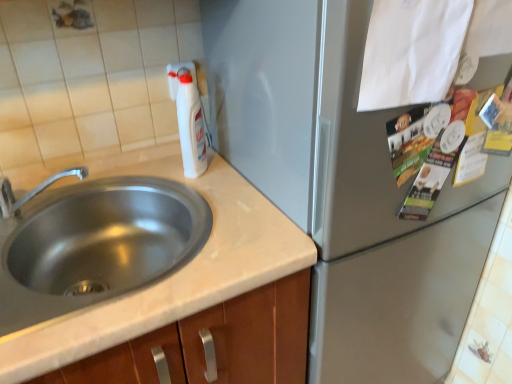
Describe the element at coordinates (31, 191) in the screenshot. The height and width of the screenshot is (384, 512). I see `brushed metal faucet at left` at that location.

Describe the element at coordinates (412, 51) in the screenshot. I see `white paper at upper right` at that location.

In order to face stainless steel sink at left, should I rotate leftwards or rightwards?

To align with it, rotate left about 20.034°.

Find the location of a particular element. The height and width of the screenshot is (384, 512). white plastic bottle at upper center is located at coordinates (189, 118).

At what (x,y) coordinates should I click in order to perform the action: click on brushed metal faucet at left. Please return your answer as a coordinate pair (x, y). Looking at the image, I should click on (31, 191).

From a real-world perspective, is satin silver refrigerator at center positioned above or below stainless steel sink at left?

From a real-world perspective, satin silver refrigerator at center is physically below stainless steel sink at left.

Based on the photo, between satin silver refrigerator at center and stainless steel sink at left, which one has more height?

satin silver refrigerator at center.

From the image's perspective, does satin silver refrigerator at center appear lower than stainless steel sink at left?

No.

Locate an element on the screen. The height and width of the screenshot is (384, 512). appliance in front of the stainless steel sink at left is located at coordinates point(346,189).

From the image's perspective, is brushed metal faucet at left below satin silver refrigerator at center?

No, from the image's perspective, brushed metal faucet at left is not beneath satin silver refrigerator at center.

Considering the sizes of objects brushed metal faucet at left and satin silver refrigerator at center in the image provided, who is thinner, brushed metal faucet at left or satin silver refrigerator at center?

With smaller width is brushed metal faucet at left.

Can you confirm if brushed metal faucet at left is bigger than satin silver refrigerator at center?

Incorrect, brushed metal faucet at left is not larger than satin silver refrigerator at center.

Considering the relative positions of brushed metal faucet at left and satin silver refrigerator at center in the image provided, is brushed metal faucet at left to the left of satin silver refrigerator at center from the viewer's perspective?

Yes, brushed metal faucet at left is to the left of satin silver refrigerator at center.

Between point (417, 41) and point (143, 219), which one is positioned behind?

Positioned behind is point (143, 219).

Consider the image. Is white paper at upper right in front of or behind stainless steel sink at left in the image?

white paper at upper right is in front of stainless steel sink at left.

From the image's perspective, relative to stainless steel sink at left, is white paper at upper right above or below?

white paper at upper right is above stainless steel sink at left.

Does white paper at upper right have a lesser height compared to stainless steel sink at left?

No.

Looking at their sizes, would you say stainless steel sink at left is wider or thinner than satin silver refrigerator at center?

stainless steel sink at left is thinner than satin silver refrigerator at center.

From the image's perspective, which one is positioned higher, stainless steel sink at left or satin silver refrigerator at center?

satin silver refrigerator at center is shown above in the image.

Does stainless steel sink at left turn towards satin silver refrigerator at center?

No, stainless steel sink at left is not oriented towards satin silver refrigerator at center.

From a real-world perspective, does brushed metal faucet at left sit lower than white paper at upper right?

Yes, from a real-world perspective, brushed metal faucet at left is under white paper at upper right.

Can you confirm if brushed metal faucet at left is taller than white paper at upper right?

No, brushed metal faucet at left is not taller than white paper at upper right.

Considering the positions of objects brushed metal faucet at left and white paper at upper right in the image provided, who is in front, brushed metal faucet at left or white paper at upper right?

white paper at upper right is more forward.

How far apart are brushed metal faucet at left and white paper at upper right?

They are 75.04 centimeters apart.

From the image's perspective, which one is positioned higher, white plastic bottle at upper center or brushed metal faucet at left?

white plastic bottle at upper center.

Between point (201, 135) and point (30, 192), which one is positioned in front?

The point (30, 192) is closer.

From a real-world perspective, between white plastic bottle at upper center and brushed metal faucet at left, who is vertically lower?

brushed metal faucet at left is physically lower.

Can you confirm if stainless steel sink at left is positioned to the right of white paper at upper right?

No.

Could you tell me if stainless steel sink at left is facing white paper at upper right?

No.

From a real-world perspective, is stainless steel sink at left physically located above or below white paper at upper right?

Clearly, from a real-world perspective, stainless steel sink at left is below white paper at upper right.

From the picture: Would you say stainless steel sink at left is a long distance from white paper at upper right?

No, there isn't a large distance between stainless steel sink at left and white paper at upper right.

Image resolution: width=512 pixels, height=384 pixels. I want to click on appliance above the stainless steel sink at left (from the image's perspective), so (x=346, y=189).

Locate an element on the screen. tap that appears on the left of satin silver refrigerator at center is located at coordinates (31, 191).

In the scene shown: When comparing their distances from white plastic bottle at upper center, does stainless steel sink at left or white paper at upper right seem closer?

Among the two, stainless steel sink at left is located nearer to white plastic bottle at upper center.

From the image, which object appears to be farther from brushed metal faucet at left, satin silver refrigerator at center or white paper at upper right?

Based on the image, white paper at upper right appears to be further to brushed metal faucet at left.

When comparing their distances from stainless steel sink at left, does white paper at upper right or satin silver refrigerator at center seem closer?

Based on the image, satin silver refrigerator at center appears to be nearer to stainless steel sink at left.

Which object lies further to the anchor point stainless steel sink at left, brushed metal faucet at left or white plastic bottle at upper center?

Among the two, white plastic bottle at upper center is located further to stainless steel sink at left.

From the image, which object appears to be nearer to white paper at upper right, satin silver refrigerator at center or white plastic bottle at upper center?

satin silver refrigerator at center is closer to white paper at upper right.

Which object lies nearer to the anchor point brushed metal faucet at left, white plastic bottle at upper center or stainless steel sink at left?

stainless steel sink at left lies closer to brushed metal faucet at left than the other object.

Based on their spatial positions, is brushed metal faucet at left or stainless steel sink at left closer to white plastic bottle at upper center?

stainless steel sink at left is closer to white plastic bottle at upper center.

Considering their positions, is brushed metal faucet at left positioned further to white paper at upper right than satin silver refrigerator at center?

brushed metal faucet at left is positioned further to the anchor white paper at upper right.

Image resolution: width=512 pixels, height=384 pixels. I want to click on sink between brushed metal faucet at left and satin silver refrigerator at center from left to right, so click(x=95, y=245).

This screenshot has height=384, width=512. I want to click on sink between brushed metal faucet at left and white plastic bottle at upper center in the horizontal direction, so click(x=95, y=245).

Identify the location of bottle located between brushed metal faucet at left and white paper at upper right in the left-right direction. This screenshot has height=384, width=512. (189, 118).

Where is `bottle situated between stainless steel sink at left and white paper at upper right from left to right`? The image size is (512, 384). bottle situated between stainless steel sink at left and white paper at upper right from left to right is located at coordinates (189, 118).